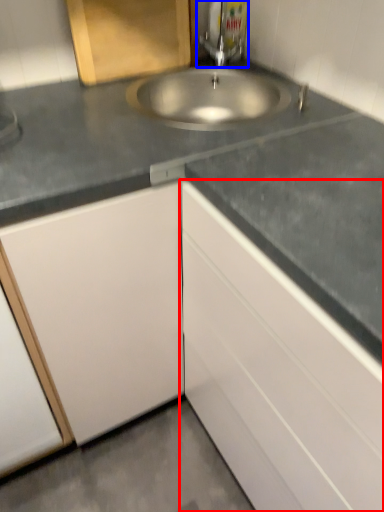
Question: Which object appears farthest to the camera in this image, cabinetry (highlighted by a red box) or tap (highlighted by a blue box)?

Choices:
 (A) cabinetry
 (B) tap

Answer: (B)